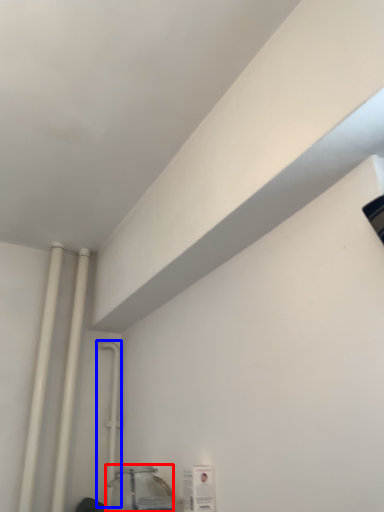
Question: Which of the following is the farthest to the observer, glass jar (highlighted by a red box) or pipe (highlighted by a blue box)?

Choices:
 (A) glass jar
 (B) pipe

Answer: (B)